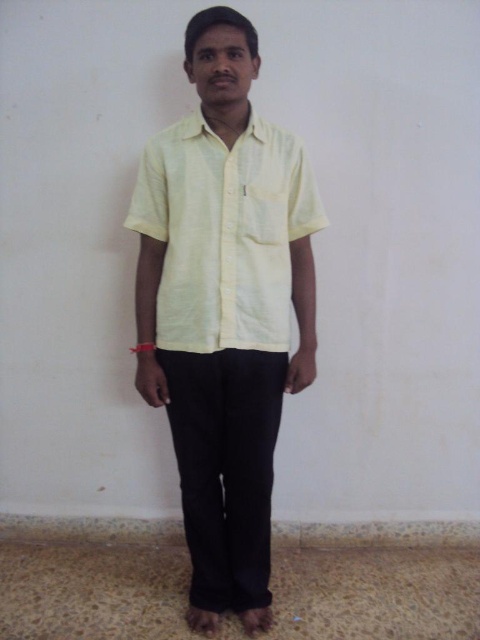
Question: Which of the following is the farthest from the observer?

Choices:
 (A) black cotton pants at center
 (B) light yellow fabric shirt at center
 (C) light yellow linen shirt at center

Answer: (A)

Question: In this image, where is light yellow fabric shirt at center located relative to black cotton pants at center?

Choices:
 (A) below
 (B) above

Answer: (B)

Question: Which is nearer to the light yellow fabric shirt at center?

Choices:
 (A) black cotton pants at center
 (B) light yellow linen shirt at center

Answer: (B)

Question: Is light yellow fabric shirt at center bigger than light yellow linen shirt at center?

Choices:
 (A) yes
 (B) no

Answer: (A)

Question: Can you confirm if light yellow fabric shirt at center is positioned below light yellow linen shirt at center?

Choices:
 (A) no
 (B) yes

Answer: (B)

Question: Which object is positioned farthest from the light yellow linen shirt at center?

Choices:
 (A) light yellow fabric shirt at center
 (B) black cotton pants at center

Answer: (B)